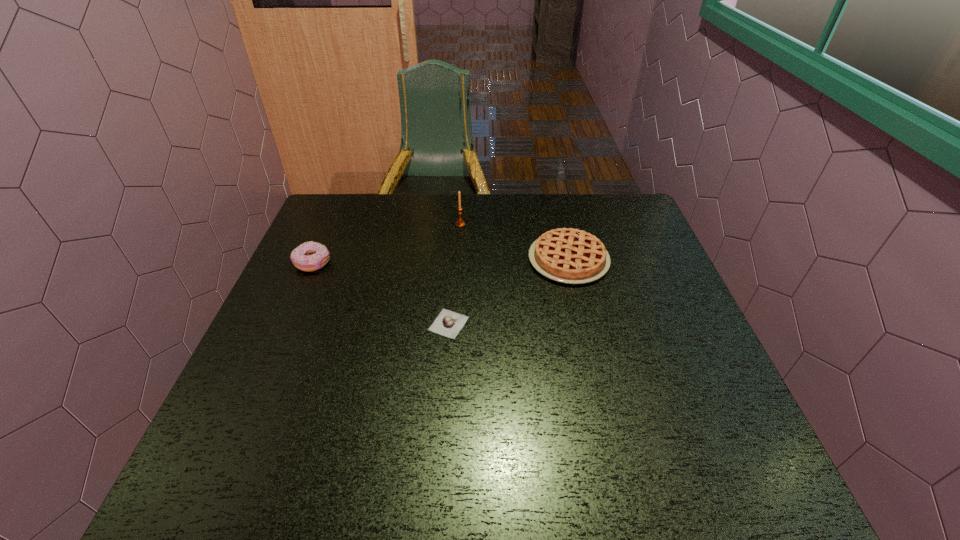
You are a GUI agent. You are given a task and a screenshot of the screen. Output one action in this format:
    pyautogui.click(x=<x>, y=<y>)
    Task: Click on the vacant area at the near left corner of the desktop
    
    Given the screenshot: What is the action you would take?
    pyautogui.click(x=227, y=495)

At what (x,y) coordinates should I click in order to perform the action: click on vacant space at the near right corner of the desktop. Please return your answer as a coordinate pair (x, y). Looking at the image, I should click on (744, 475).

Where is `vacant point located between the third tallest object and the farthest object`? This screenshot has height=540, width=960. vacant point located between the third tallest object and the farthest object is located at coordinates (515, 242).

Identify the location of free space between the garlic and the doughnut. The image size is (960, 540). (381, 294).

Where is `vacant area that lies between the nearest object and the pie`? This screenshot has width=960, height=540. vacant area that lies between the nearest object and the pie is located at coordinates (509, 292).

This screenshot has height=540, width=960. Find the location of `vacant point located between the farthest object and the doughnut`. vacant point located between the farthest object and the doughnut is located at coordinates (387, 244).

What are the coordinates of `empty space that is in between the farthest object and the doughnut` in the screenshot? It's located at (387, 244).

You are a GUI agent. You are given a task and a screenshot of the screen. Output one action in this format:
    pyautogui.click(x=<x>, y=<y>)
    Task: Click on the free area in between the farthest object and the pie
    This screenshot has width=960, height=540.
    Given the screenshot: What is the action you would take?
    pyautogui.click(x=515, y=242)

Where is `vacant area that lies between the garlic and the doughnut`? This screenshot has width=960, height=540. vacant area that lies between the garlic and the doughnut is located at coordinates (381, 294).

Identify the location of free space between the third tallest object and the candle_holder. (515, 242).